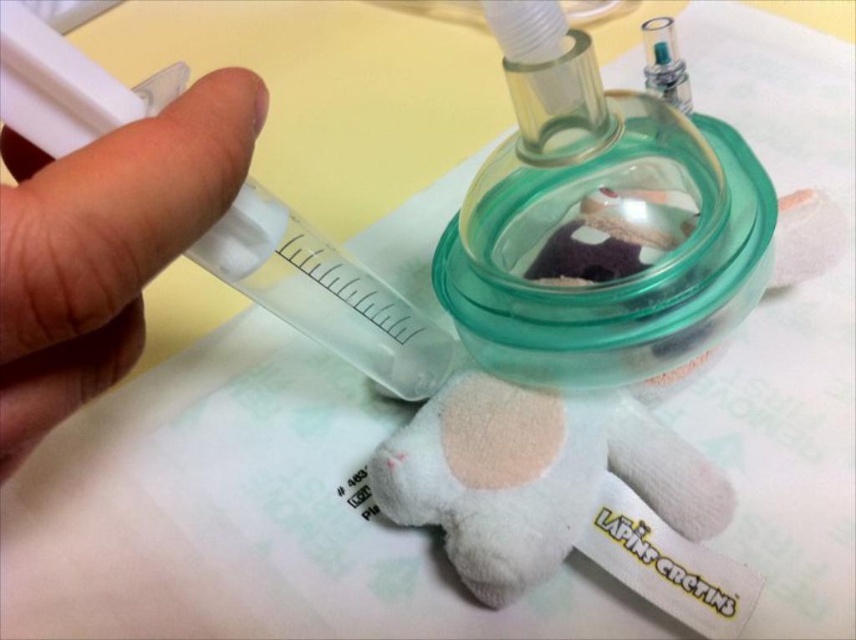
In the image, you see a white plush toy at center and a transparent plastic syringe at left. Which object is bigger?

The white plush toy at center is larger in size than the transparent plastic syringe at left.

Looking at this image, you are a medical professional observing the scene. The transparent plastic syringe at left is needed to administer medication through the oxygen mask. Based on its position, can you determine if it is positioned correctly for administering the medication into the mask?

The transparent plastic syringe at left is located at point [105,244], which is the correct position for administering medication into the oxygen mask.